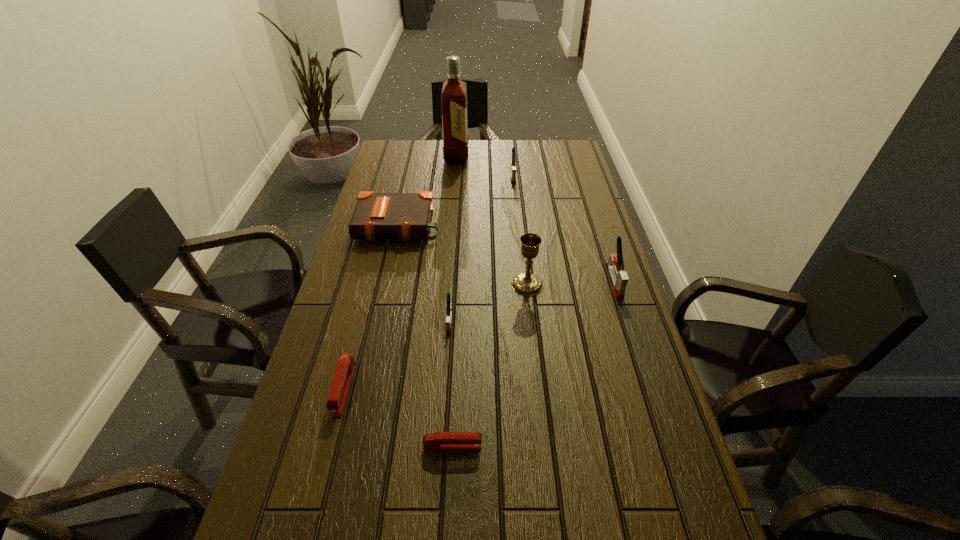
The width and height of the screenshot is (960, 540). Identify the location of the farthest object. (454, 92).

At what (x,y) coordinates should I click in order to perform the action: click on the tallest object. Please return your answer as a coordinate pair (x, y). Looking at the image, I should click on (454, 92).

Identify the location of chalice. Image resolution: width=960 pixels, height=540 pixels. coord(526,284).

The height and width of the screenshot is (540, 960). I want to click on the second farthest gray stapler, so click(x=615, y=266).

I want to click on the rightmost stapler, so coord(615,266).

The image size is (960, 540). In order to click on the second tallest stapler in this screenshot , I will do 513,168.

This screenshot has height=540, width=960. I want to click on the second smallest gray stapler, so click(x=513, y=168).

You are a GUI agent. You are given a task and a screenshot of the screen. Output one action in this format:
    pyautogui.click(x=<x>, y=<y>)
    Task: Click on the smallest gray stapler
    This screenshot has height=540, width=960.
    Given the screenshot: What is the action you would take?
    pyautogui.click(x=449, y=306)

You are a GUI agent. You are given a task and a screenshot of the screen. Output one action in this format:
    pyautogui.click(x=<x>, y=<y>)
    Task: Click on the leftmost gray stapler
    
    Given the screenshot: What is the action you would take?
    tap(449, 306)

This screenshot has width=960, height=540. I want to click on Bible, so click(x=407, y=216).